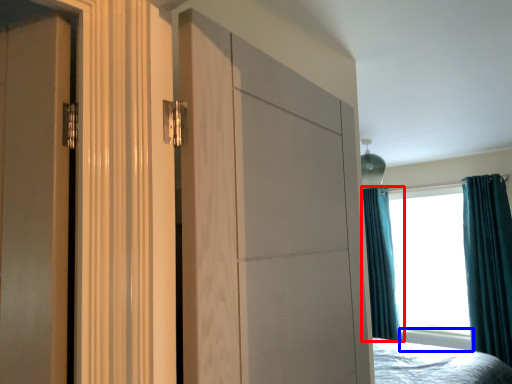
Question: Among these objects, which one is farthest to the camera, curtain (highlighted by a red box) or radiator (highlighted by a blue box)?

Choices:
 (A) curtain
 (B) radiator

Answer: (A)